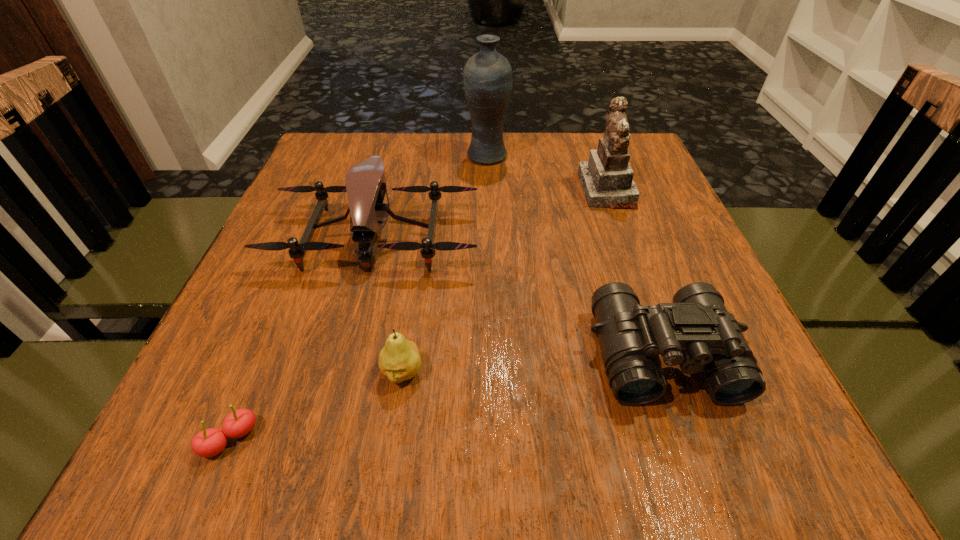
At what (x,y) coordinates should I click in order to perform the action: click on blank space located on the front-facing side of the second tallest object. Please return your answer as a coordinate pair (x, y). This screenshot has height=540, width=960. Looking at the image, I should click on (513, 190).

Locate an element on the screen. free space located 0.260m on the front-facing side of the second tallest object is located at coordinates (469, 190).

Identify the location of vacant space located on the front-facing side of the drone. (336, 391).

At what (x,y) coordinates should I click in order to perform the action: click on free spot located 0.060m through the lenses of the third shortest object. Please return your answer as a coordinate pair (x, y). The height and width of the screenshot is (540, 960). Looking at the image, I should click on (695, 448).

At what (x,y) coordinates should I click in order to perform the action: click on free region located 0.190m on the back of the fifth tallest object. Please return your answer as a coordinate pair (x, y). Looking at the image, I should click on (417, 271).

The width and height of the screenshot is (960, 540). Find the location of `vacant space situated on the right of the cherry`. vacant space situated on the right of the cherry is located at coordinates tap(411, 439).

You are a GUI agent. You are given a task and a screenshot of the screen. Output one action in this format:
    pyautogui.click(x=<x>, y=<y>)
    Task: Click on the vase located at the far edge
    The image size is (960, 540).
    Given the screenshot: What is the action you would take?
    pyautogui.click(x=487, y=79)

Image resolution: width=960 pixels, height=540 pixels. I want to click on figurine that is at the far edge, so click(x=607, y=178).

At what (x,y) coordinates should I click in order to perform the action: click on object present at the near edge. Please return your answer as a coordinate pair (x, y). Looking at the image, I should click on (210, 442).

Where is `drone that is at the left edge`? drone that is at the left edge is located at coordinates [x=365, y=182].